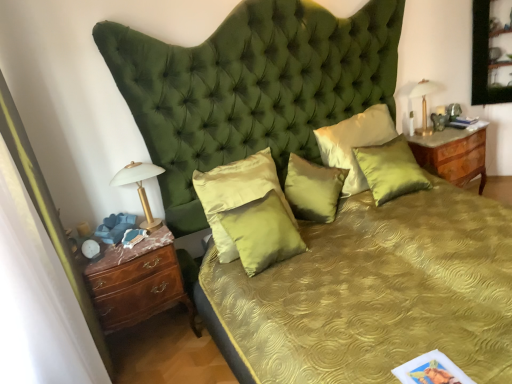
Identify the location of vacant point above brown wood chest of drawers at left (from a real-world perspective). (132, 246).